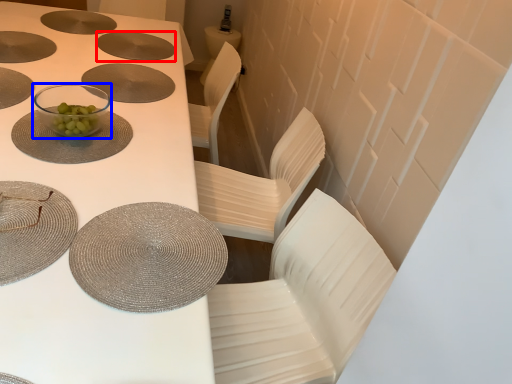
Question: Which object is closer to the camera taking this photo, tableware (highlighted by a red box) or tableware (highlighted by a blue box)?

Choices:
 (A) tableware
 (B) tableware

Answer: (B)